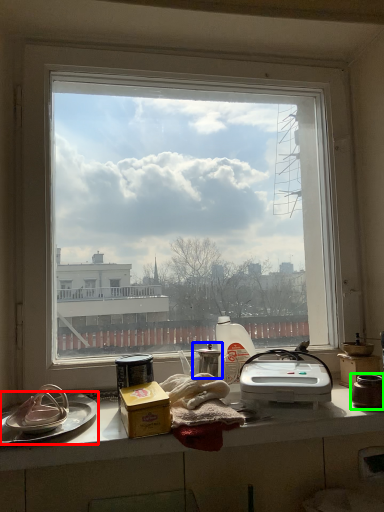
Question: Which object is positioned closest to platter (highlighted by a red box)? Select from appliance (highlighted by a blue box) and appliance (highlighted by a green box).

Choices:
 (A) appliance
 (B) appliance

Answer: (A)